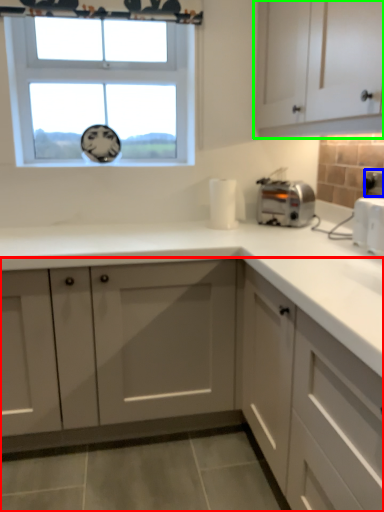
Question: Which object is the closest to the cabinetry (highlighted by a red box)? Choose among these: electric outlet (highlighted by a blue box) or cabinetry (highlighted by a green box).

Choices:
 (A) electric outlet
 (B) cabinetry

Answer: (B)